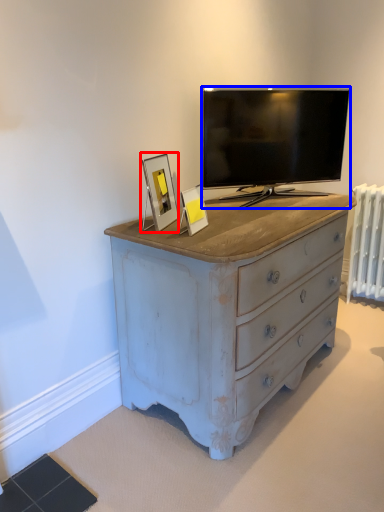
Question: Which object appears farthest to the camera in this image, picture frame (highlighted by a red box) or television (highlighted by a blue box)?

Choices:
 (A) picture frame
 (B) television

Answer: (B)